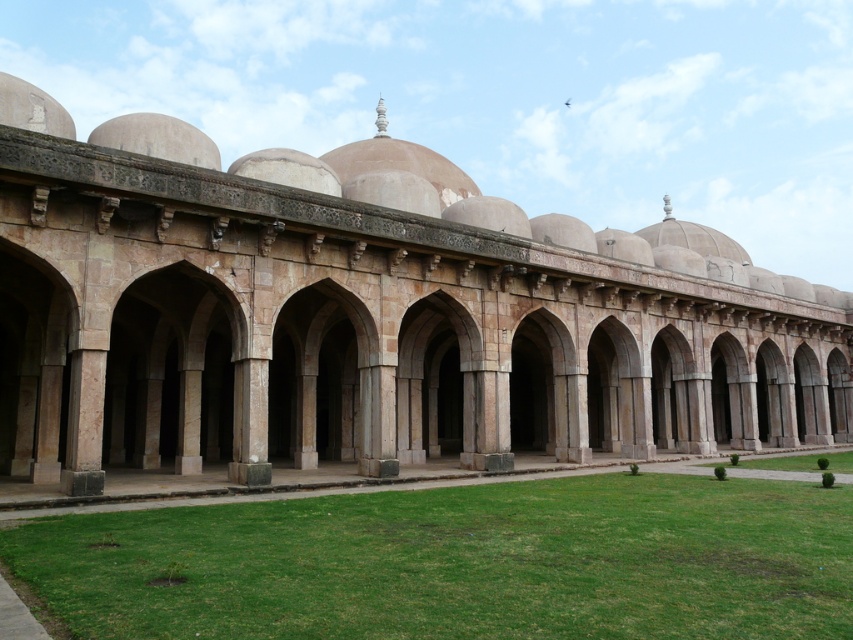
You are a landscape architect designing a garden around the beige stone arches at center and green grass at lower center. Considering their height difference, which object would require more vertical space in the garden plan?

The beige stone arches at center require more vertical space because they are much taller than the green grass at lower center.

From the picture: You are a landscape architect designing a pathway that needs to be as wide as the green grass at lower center. Can the pathway fit between the beige stone arches at center without being narrower than the grass?

The beige stone arches at center might be wider than green grass at lower center, so the pathway could potentially fit between them without being narrower than the grass.